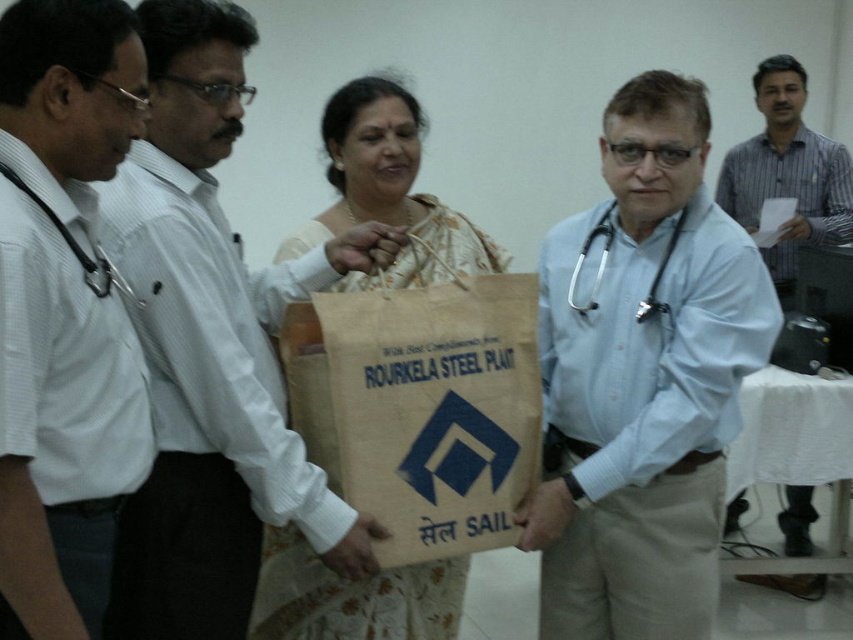
Question: Considering the relative positions of black rubber stethoscope at center and matte black stethoscope at left in the image provided, where is black rubber stethoscope at center located with respect to matte black stethoscope at left?

Choices:
 (A) below
 (B) above

Answer: (B)

Question: Does matte white shirt at center appear on the right side of brown paper bag at center?

Choices:
 (A) no
 (B) yes

Answer: (A)

Question: From the image, what is the correct spatial relationship of matte white shirt at center in relation to beige fabric saree at center?

Choices:
 (A) above
 (B) below

Answer: (B)

Question: Which point appears farthest from the camera in this image?

Choices:
 (A) [546, 248]
 (B) [415, 99]
 (C) [595, 294]

Answer: (B)

Question: Which object is closer to the camera taking this photo?

Choices:
 (A) black rubber stethoscope at center
 (B) brown paper bag at center

Answer: (B)

Question: Among these objects, which one is nearest to the camera?

Choices:
 (A) matte white shirt at center
 (B) white shirt at center

Answer: (A)